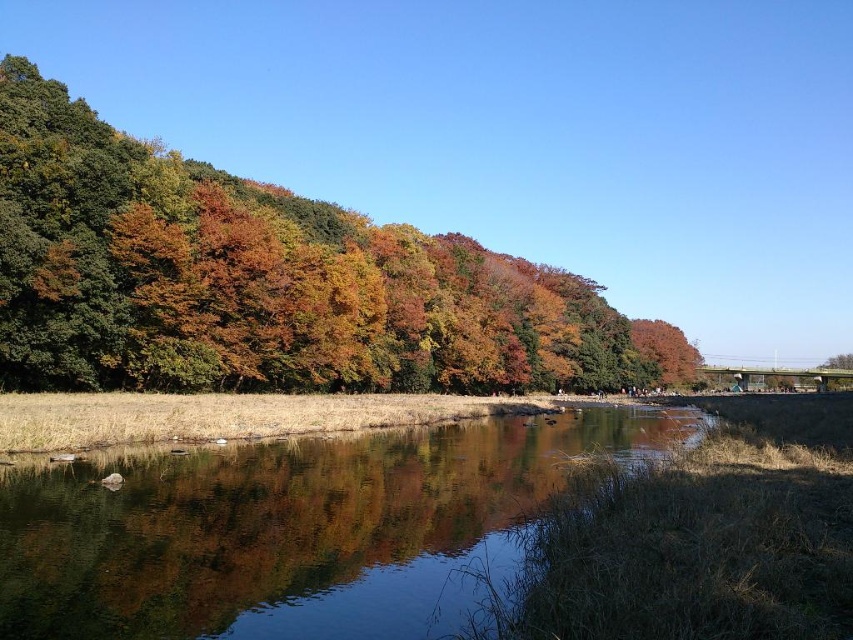
Question: From the image, what is the correct spatial relationship of autumn leaves at upper left in relation to clear water at center?

Choices:
 (A) right
 (B) left

Answer: (A)

Question: Is the position of autumn leaves at upper left less distant than that of clear water at center?

Choices:
 (A) yes
 (B) no

Answer: (B)

Question: Is autumn leaves at upper left below clear water at center?

Choices:
 (A) no
 (B) yes

Answer: (A)

Question: Which point is closer to the camera?

Choices:
 (A) autumn leaves at upper left
 (B) clear water at center

Answer: (B)

Question: Among these objects, which one is nearest to the camera?

Choices:
 (A) autumn leaves at upper left
 (B) clear water at center

Answer: (B)